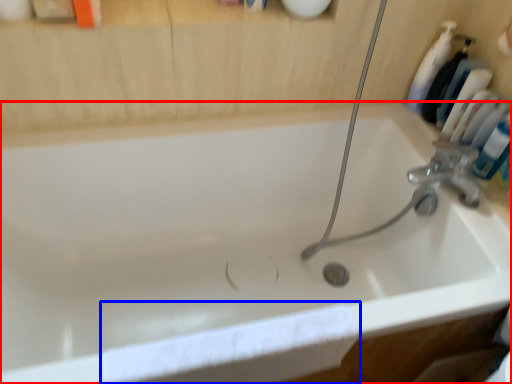
Question: Which object is closer to the camera taking this photo, bathtub (highlighted by a red box) or bath towel (highlighted by a blue box)?

Choices:
 (A) bathtub
 (B) bath towel

Answer: (A)